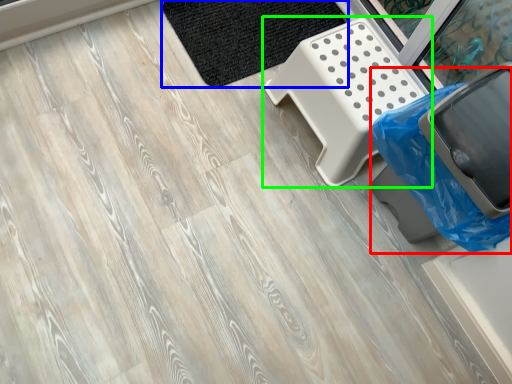
Question: Based on their relative distances, which object is farther from garbage (highlighted by a red box)? Choose from mat (highlighted by a blue box) and furniture (highlighted by a green box).

Choices:
 (A) mat
 (B) furniture

Answer: (A)